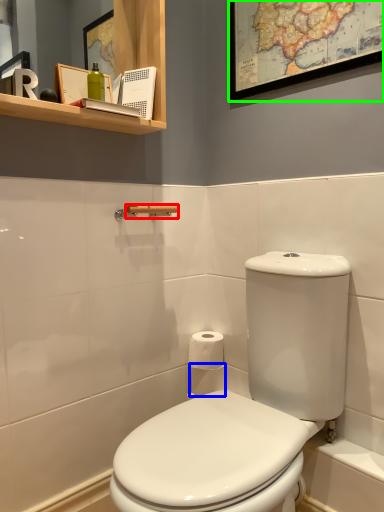
Question: Considering the real-world distances, which object is closest to towel bar (highlighted by a red box)? toilet paper (highlighted by a blue box) or picture frame (highlighted by a green box).

Choices:
 (A) toilet paper
 (B) picture frame

Answer: (A)